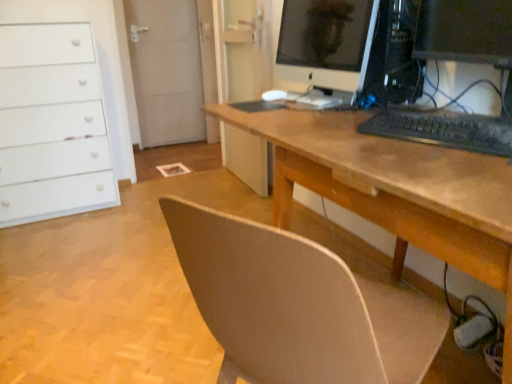
The image size is (512, 384). What are the coordinates of `free space to the left of wooden desk at center` in the screenshot? It's located at point(113,298).